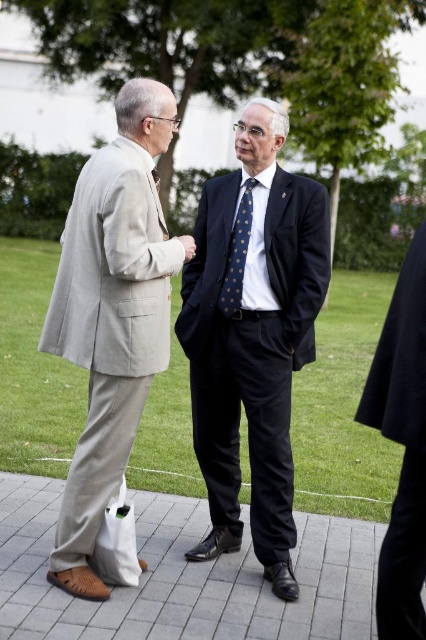
Question: Based on their relative distances, which object is farther from the blue dotted tie at center?

Choices:
 (A) light beige fabric suit at left
 (B) polished dark blue suit at center

Answer: (A)

Question: Does polished dark blue suit at center have a greater width compared to light beige fabric suit at left?

Choices:
 (A) yes
 (B) no

Answer: (A)

Question: Is polished dark blue suit at center in front of blue dotted tie at center?

Choices:
 (A) no
 (B) yes

Answer: (B)

Question: Among these points, which one is nearest to the camera?

Choices:
 (A) (140, 156)
 (B) (282, 470)
 (C) (244, 244)

Answer: (A)

Question: Estimate the real-world distances between objects in this image. Which object is closer to the blue dotted tie at center?

Choices:
 (A) polished dark blue suit at center
 (B) light beige fabric suit at left

Answer: (A)

Question: Is the position of polished dark blue suit at center more distant than that of light beige fabric suit at left?

Choices:
 (A) no
 (B) yes

Answer: (B)